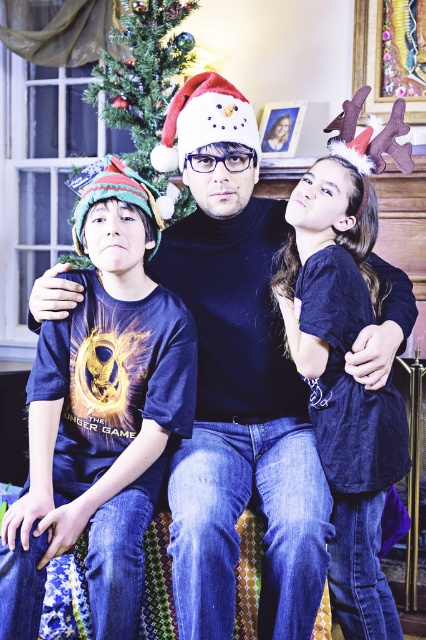
Between dark blue velvet shirt at upper right and green matte christmas tree at upper left, which one is positioned lower?

dark blue velvet shirt at upper right is below.

This screenshot has height=640, width=426. What do you see at coordinates (344, 387) in the screenshot? I see `dark blue velvet shirt at upper right` at bounding box center [344, 387].

Where is `dark blue velvet shirt at upper right`? Image resolution: width=426 pixels, height=640 pixels. dark blue velvet shirt at upper right is located at coordinates (344, 387).

Can you confirm if blue cotton shirt at left is positioned above dark blue velvet shirt at upper right?

Correct, blue cotton shirt at left is located above dark blue velvet shirt at upper right.

Does blue cotton shirt at left have a lesser height compared to dark blue velvet shirt at upper right?

Correct, blue cotton shirt at left is not as tall as dark blue velvet shirt at upper right.

You are a GUI agent. You are given a task and a screenshot of the screen. Output one action in this format:
    pyautogui.click(x=<x>, y=<y>)
    Task: Click on the blue cotton shirt at left
    
    Given the screenshot: What is the action you would take?
    pyautogui.click(x=100, y=413)

Locate an element on the screen. The image size is (426, 640). blue cotton shirt at left is located at coordinates tap(100, 413).

Is green matte christmas tree at upper left thinner than snowman fabric hat at center?

No.

Does green matte christmas tree at upper left lie behind snowman fabric hat at center?

Yes, it is behind snowman fabric hat at center.

Does point (120, 22) come farther from viewer compared to point (166, 118)?

Yes, point (120, 22) is farther from viewer.

This screenshot has width=426, height=640. I want to click on green matte christmas tree at upper left, so click(143, 76).